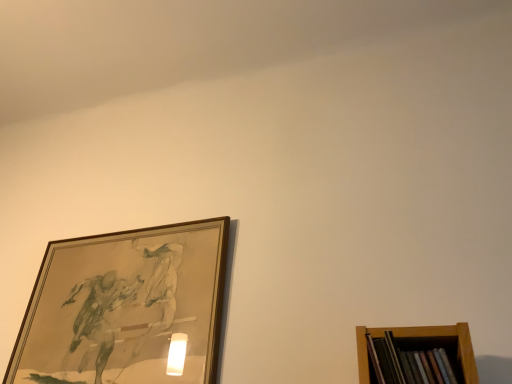
Question: Should I look upward or downward to see wooden picture frame at upper left?

Choices:
 (A) up
 (B) down

Answer: (B)